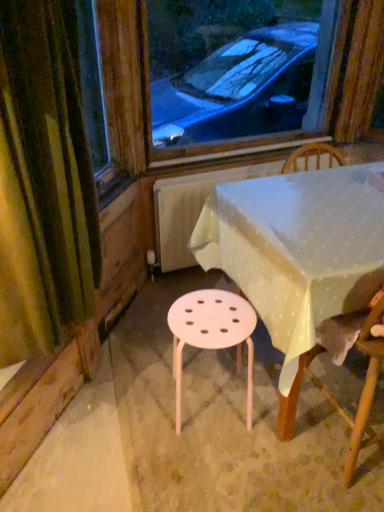
In order to click on free space above pink plastic stool at center (from a real-world perspective) in this screenshot , I will do `click(207, 320)`.